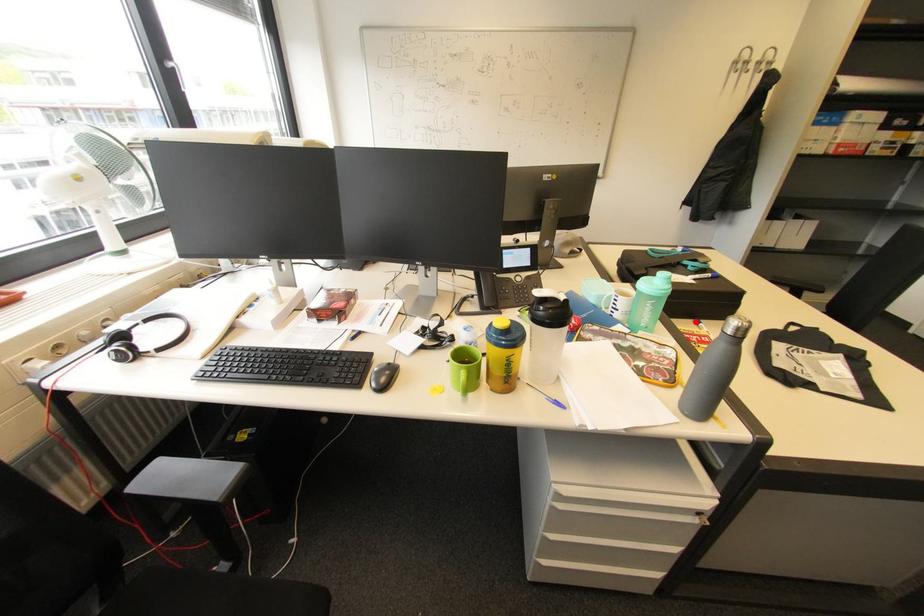
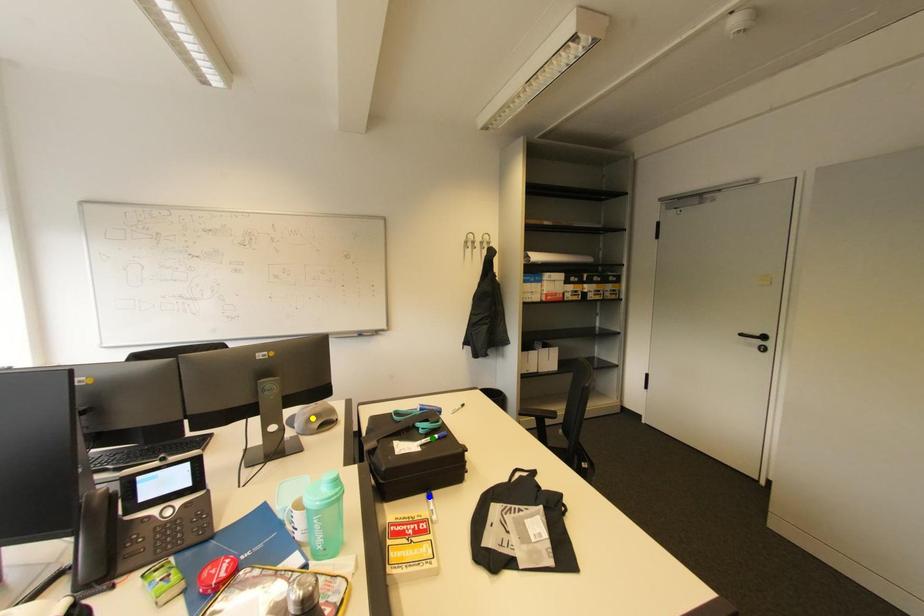
Question: I am providing you with two images of the same scene from different viewpoints. A red point is marked on the first image. You are given multiple points on the second image. Which mark in image 2 goes with the point in image 1?

Choices:
 (A) blue point
 (B) green point
 (C) yellow point

Answer: (A)